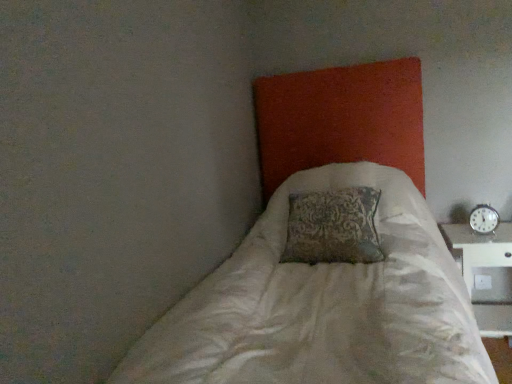
Question: Does metallic silver clock at right lie behind white textured bed at center?

Choices:
 (A) no
 (B) yes

Answer: (B)

Question: Can you see metallic silver clock at right touching white textured bed at center?

Choices:
 (A) no
 (B) yes

Answer: (A)

Question: From the image's perspective, is metallic silver clock at right located beneath white textured bed at center?

Choices:
 (A) no
 (B) yes

Answer: (A)

Question: Is metallic silver clock at right bigger than white textured bed at center?

Choices:
 (A) yes
 (B) no

Answer: (B)

Question: Is metallic silver clock at right far from white textured bed at center?

Choices:
 (A) no
 (B) yes

Answer: (A)

Question: Does metallic silver clock at right contain white textured bed at center?

Choices:
 (A) yes
 (B) no

Answer: (B)

Question: Can you confirm if white textured bed at center is wider than white plastic table at right?

Choices:
 (A) yes
 (B) no

Answer: (A)

Question: Can you confirm if white textured bed at center is positioned to the left of white plastic table at right?

Choices:
 (A) no
 (B) yes

Answer: (B)

Question: Is white textured bed at center positioned beyond the bounds of white plastic table at right?

Choices:
 (A) no
 (B) yes

Answer: (B)

Question: Are white textured bed at center and white plastic table at right beside each other?

Choices:
 (A) yes
 (B) no

Answer: (B)

Question: Is white textured bed at center facing towards white plastic table at right?

Choices:
 (A) no
 (B) yes

Answer: (A)

Question: Is white textured bed at center taller than white plastic table at right?

Choices:
 (A) no
 (B) yes

Answer: (B)

Question: Does white textured bed at center lie behind metallic silver clock at right?

Choices:
 (A) no
 (B) yes

Answer: (A)